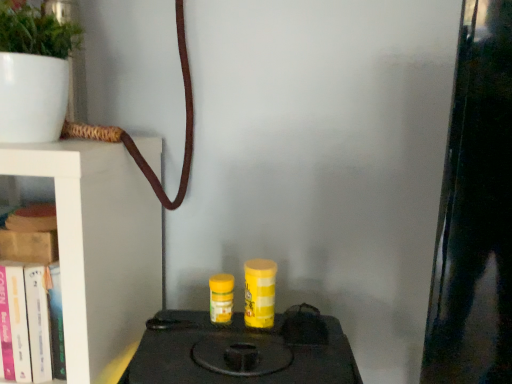
Question: In the image, is wooden book at left, acting as the 2th book starting from the bottom, on the left side or the right side of white matte pot at upper left?

Choices:
 (A) right
 (B) left

Answer: (A)

Question: From the image's perspective, is wooden book at left, acting as the 2th book starting from the bottom, positioned above or below white matte pot at upper left?

Choices:
 (A) below
 (B) above

Answer: (A)

Question: Which is farther from the white matte pot at upper left?

Choices:
 (A) wooden book at left, acting as the 2th book starting from the bottom
 (B) black matte stove at center
 (C) hardcover book at left, marked as the 1th book in a bottom-to-top arrangement

Answer: (B)

Question: Estimate the real-world distances between objects in this image. Which object is closer to the black matte stove at center?

Choices:
 (A) white matte pot at upper left
 (B) wooden book at left, which is counted as the 1th book, starting from the top
 (C) hardcover book at left, marked as the 1th book in a bottom-to-top arrangement

Answer: (C)